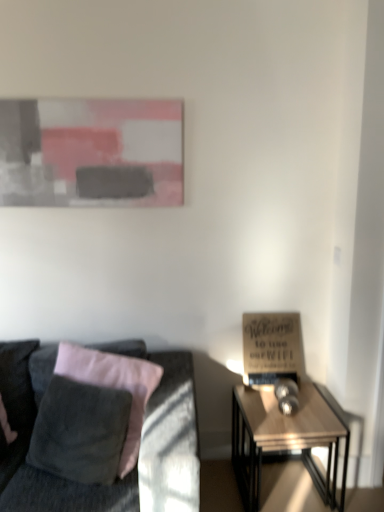
Locate an element on the screen. This screenshot has width=384, height=512. wooden glossy table at right is located at coordinates (285, 439).

The image size is (384, 512). I want to click on matte gray painting at upper center, so click(x=91, y=152).

The height and width of the screenshot is (512, 384). Describe the element at coordinates (91, 152) in the screenshot. I see `matte gray painting at upper center` at that location.

The image size is (384, 512). What are the coordinates of `wooden sign at right` in the screenshot? It's located at (272, 348).

Identify the location of wooden glossy table at right. (285, 439).

Is wooden sign at right smaller than wooden glossy table at right?

Yes, wooden sign at right is smaller than wooden glossy table at right.

Can you tell me how much wooden sign at right and wooden glossy table at right differ in facing direction?

2.86 degrees separate the facing orientations of wooden sign at right and wooden glossy table at right.

You are a GUI agent. You are given a task and a screenshot of the screen. Output one action in this format:
    pyautogui.click(x=<x>, y=<y>)
    Task: Click on the table below the wooden sign at right (from the image's perspective)
    The height and width of the screenshot is (512, 384).
    Given the screenshot: What is the action you would take?
    pyautogui.click(x=285, y=439)

Which point is more forward, (175,448) or (279,434)?

Positioned in front is point (175,448).

Is velvet gray couch at left smaller than wooden glossy table at right?

No.

From the image's perspective, which is above, velvet gray couch at left or wooden glossy table at right?

From the image's view, velvet gray couch at left is above.

This screenshot has height=512, width=384. I want to click on studio couch on the left of wooden glossy table at right, so click(x=138, y=459).

Consider the image. Who is taller, wooden glossy table at right or velvet gray couch at left?

velvet gray couch at left.

Considering the sizes of objects wooden glossy table at right and velvet gray couch at left in the image provided, who is bigger, wooden glossy table at right or velvet gray couch at left?

With larger size is velvet gray couch at left.

From the image's perspective, which is below, wooden glossy table at right or velvet gray couch at left?

From the image's view, wooden glossy table at right is below.

You are a GUI agent. You are given a task and a screenshot of the screen. Output one action in this format:
    pyautogui.click(x=<x>, y=<y>)
    Task: Click on the studio couch above the wooden glossy table at right (from a real-world perspective)
    
    Given the screenshot: What is the action you would take?
    pyautogui.click(x=138, y=459)

Considering the sizes of objects velvet gray couch at left and wooden sign at right in the image provided, who is shorter, velvet gray couch at left or wooden sign at right?

wooden sign at right.

What's the angular difference between velvet gray couch at left and wooden sign at right's facing directions?

The angle between the facing direction of velvet gray couch at left and the facing direction of wooden sign at right is 0.528 degrees.

Is point (169, 452) farther from viewer compared to point (257, 324)?

No, (169, 452) is in front of (257, 324).

You are a GUI agent. You are given a task and a screenshot of the screen. Output one action in this format:
    pyautogui.click(x=<x>, y=<y>)
    Task: Click on the studio couch that is under the wooden sign at right (from a real-world perspective)
    The image size is (384, 512).
    Given the screenshot: What is the action you would take?
    pyautogui.click(x=138, y=459)

Is matte gray painting at upper center closer to the viewer compared to velvet gray couch at left?

No, matte gray painting at upper center is further to the viewer.

Could velvet gray couch at left be considered to be inside matte gray painting at upper center?

No, velvet gray couch at left is located outside of matte gray painting at upper center.

What's the angular difference between matte gray painting at upper center and velvet gray couch at left's facing directions?

0.528 degrees separate the facing orientations of matte gray painting at upper center and velvet gray couch at left.

Locate an element on the screen. studio couch in front of the matte gray painting at upper center is located at coordinates (138, 459).

Which object is closer to the camera, velvet gray couch at left or matte gray painting at upper center?

velvet gray couch at left is closer to the camera.

Is velvet gray couch at left far from matte gray painting at upper center?

Absolutely, velvet gray couch at left is distant from matte gray painting at upper center.

How many degrees apart are the facing directions of velvet gray couch at left and matte gray painting at upper center?

The angle between the facing direction of velvet gray couch at left and the facing direction of matte gray painting at upper center is 0.528 degrees.

Which of these two, wooden sign at right or velvet gray couch at left, is smaller?

Smaller between the two is wooden sign at right.

The width and height of the screenshot is (384, 512). In order to click on studio couch that is under the wooden sign at right (from a real-world perspective) in this screenshot , I will do `click(138, 459)`.

Considering the positions of objects wooden sign at right and velvet gray couch at left in the image provided, who is behind, wooden sign at right or velvet gray couch at left?

wooden sign at right is more distant.

Which object is thinner, wooden sign at right or velvet gray couch at left?

wooden sign at right.

There is a wooden glossy table at right. Where is `bulletin board above it (from a real-world perspective)`? This screenshot has width=384, height=512. bulletin board above it (from a real-world perspective) is located at coordinates (272, 348).

The image size is (384, 512). I want to click on studio couch in front of the wooden glossy table at right, so click(138, 459).

Looking at the image, which one is located closer to wooden sign at right, wooden glossy table at right or matte gray painting at upper center?

wooden glossy table at right lies closer to wooden sign at right than the other object.

Based on their spatial positions, is velvet gray couch at left or matte gray painting at upper center further from wooden glossy table at right?

The object further to wooden glossy table at right is matte gray painting at upper center.

Which object lies further to the anchor point wooden glossy table at right, matte gray painting at upper center or velvet gray couch at left?

Among the two, matte gray painting at upper center is located further to wooden glossy table at right.

Looking at the image, which one is located closer to matte gray painting at upper center, wooden glossy table at right or wooden sign at right?

Based on the image, wooden sign at right appears to be nearer to matte gray painting at upper center.

When comparing their distances from matte gray painting at upper center, does wooden glossy table at right or velvet gray couch at left seem further?

wooden glossy table at right is positioned further to the anchor matte gray painting at upper center.

Consider the image. Considering their positions, is wooden sign at right positioned further to velvet gray couch at left than wooden glossy table at right?

The object further to velvet gray couch at left is wooden glossy table at right.

Considering their positions, is velvet gray couch at left positioned further to wooden sign at right than wooden glossy table at right?

velvet gray couch at left is positioned further to the anchor wooden sign at right.

Looking at the image, which one is located further to wooden glossy table at right, velvet gray couch at left or wooden sign at right?

Based on the image, velvet gray couch at left appears to be further to wooden glossy table at right.

At what (x,y) coordinates should I click in order to perform the action: click on bulletin board between matte gray painting at upper center and wooden glossy table at right vertically. Please return your answer as a coordinate pair (x, y). The image size is (384, 512). Looking at the image, I should click on (272, 348).

Image resolution: width=384 pixels, height=512 pixels. Identify the location of bulletin board between velvet gray couch at left and wooden glossy table at right. (272, 348).

What are the coordinates of `bulletin board between matte gray painting at upper center and velvet gray couch at left in the up-down direction` in the screenshot? It's located at (272, 348).

Identify the location of studio couch between matte gray painting at upper center and wooden glossy table at right vertically. (138, 459).